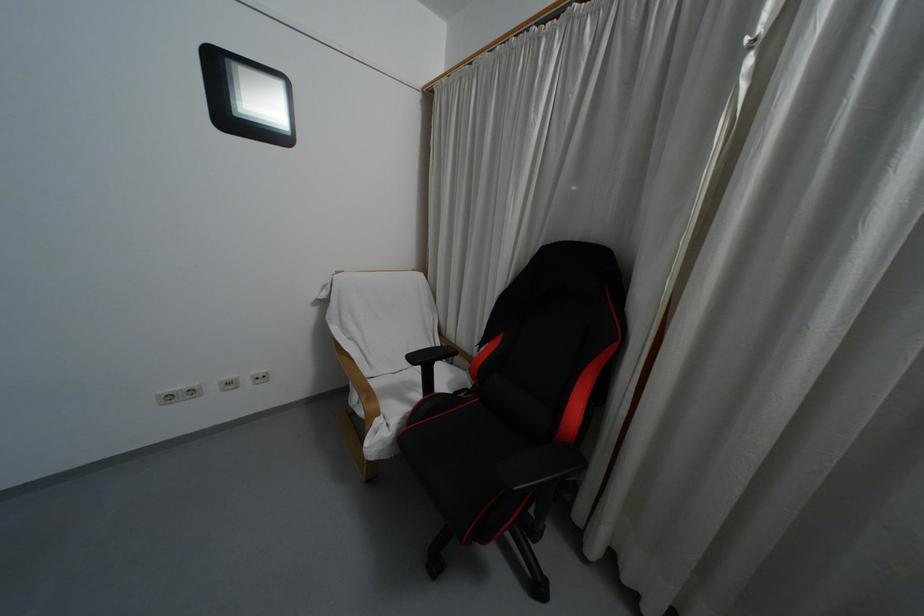
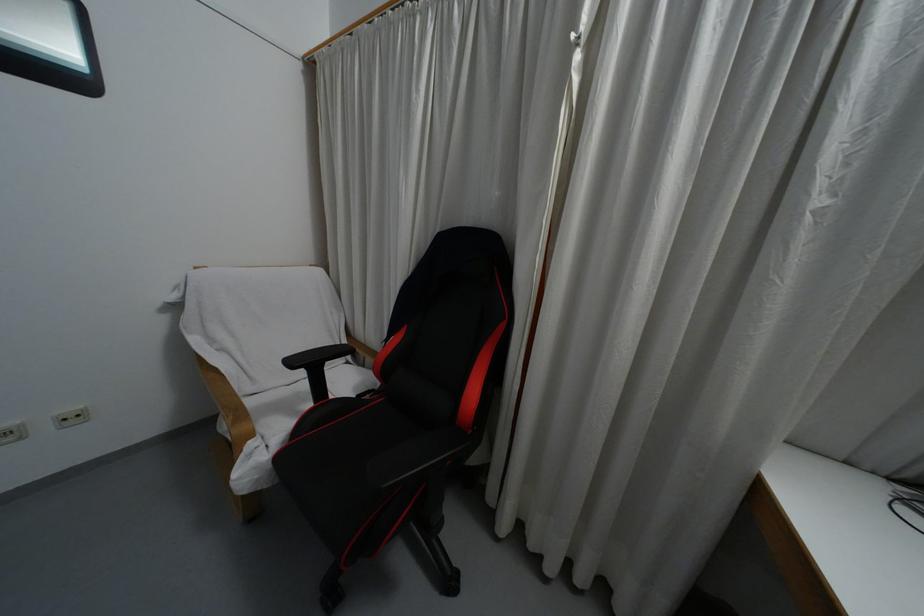
The point at (377, 413) is marked in the first image. Where is the corresponding point in the second image?

(250, 435)